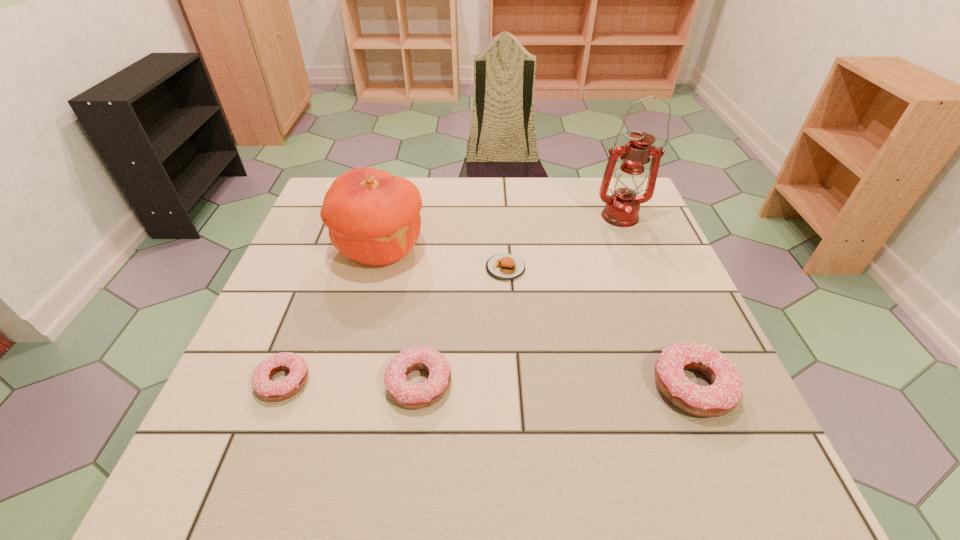
If we want them evenly spaced by inserting an extra doughnut among them, please locate a free spot for this new doughnut. Please provide its 2D coordinates. Your answer should be formatted as a tuple, i.e. [(x, y)], where the tuple contains the x and y coordinates of a point satisfying the conditions above.

[(556, 385)]